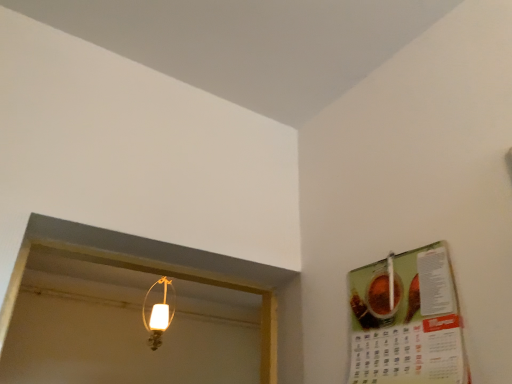
Question: Is matte glass lampshade at upper center far from green matte calendar at upper right?

Choices:
 (A) no
 (B) yes

Answer: (B)

Question: Is matte glass lampshade at upper center placed right next to green matte calendar at upper right?

Choices:
 (A) yes
 (B) no

Answer: (B)

Question: Is matte glass lampshade at upper center wider than green matte calendar at upper right?

Choices:
 (A) yes
 (B) no

Answer: (A)

Question: From the image's perspective, is matte glass lampshade at upper center beneath green matte calendar at upper right?

Choices:
 (A) no
 (B) yes

Answer: (B)

Question: Considering the relative positions of matte glass lampshade at upper center and green matte calendar at upper right in the image provided, is matte glass lampshade at upper center behind green matte calendar at upper right?

Choices:
 (A) yes
 (B) no

Answer: (A)

Question: Is matte glass lampshade at upper center facing away from green matte calendar at upper right?

Choices:
 (A) yes
 (B) no

Answer: (B)

Question: From the image's perspective, is green matte calendar at upper right located beneath matte glass lampshade at upper center?

Choices:
 (A) no
 (B) yes

Answer: (A)

Question: Is green matte calendar at upper right positioned far away from matte glass lampshade at upper center?

Choices:
 (A) yes
 (B) no

Answer: (A)

Question: Considering the relative sizes of green matte calendar at upper right and matte glass lampshade at upper center in the image provided, is green matte calendar at upper right shorter than matte glass lampshade at upper center?

Choices:
 (A) no
 (B) yes

Answer: (B)

Question: Are green matte calendar at upper right and matte glass lampshade at upper center beside each other?

Choices:
 (A) no
 (B) yes

Answer: (A)

Question: Considering the relative positions of green matte calendar at upper right and matte glass lampshade at upper center in the image provided, is green matte calendar at upper right in front of matte glass lampshade at upper center?

Choices:
 (A) no
 (B) yes

Answer: (B)

Question: Is green matte calendar at upper right at the left side of matte glass lampshade at upper center?

Choices:
 (A) yes
 (B) no

Answer: (B)

Question: Is matte glass lampshade at upper center to the left or to the right of green matte calendar at upper right in the image?

Choices:
 (A) right
 (B) left

Answer: (B)